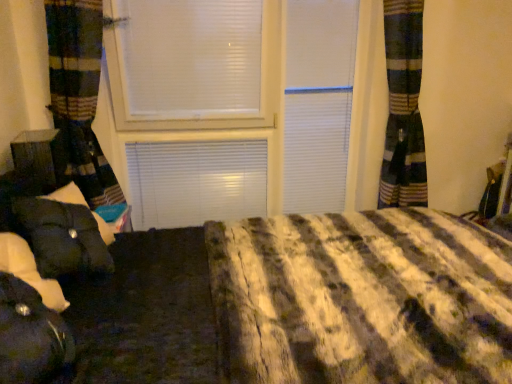
Question: From a real-world perspective, relative to matte black suitcase at left, is black fabric bean bag at lower left vertically above or below?

Choices:
 (A) below
 (B) above

Answer: (A)

Question: Choose the correct answer: Is black fabric bean bag at lower left inside matte black suitcase at left or outside it?

Choices:
 (A) outside
 (B) inside

Answer: (A)

Question: From the image's perspective, is black fabric bean bag at lower left located above or below matte black suitcase at left?

Choices:
 (A) below
 (B) above

Answer: (A)

Question: Considering the positions of matte black suitcase at left and black fabric bean bag at lower left in the image, is matte black suitcase at left bigger or smaller than black fabric bean bag at lower left?

Choices:
 (A) big
 (B) small

Answer: (B)

Question: Based on their positions, is matte black suitcase at left located to the left or right of black fabric bean bag at lower left?

Choices:
 (A) left
 (B) right

Answer: (A)

Question: From a real-world perspective, is matte black suitcase at left physically located above or below black fabric bean bag at lower left?

Choices:
 (A) above
 (B) below

Answer: (A)

Question: Choose the correct answer: Is matte black suitcase at left inside black fabric bean bag at lower left or outside it?

Choices:
 (A) outside
 (B) inside

Answer: (A)